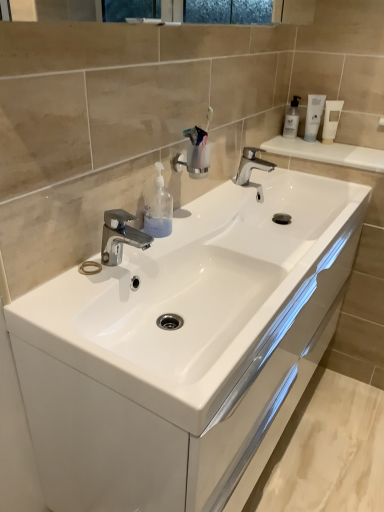
Where is `free space behind polished chrome faucet at center, which is counted as the 2th tap, starting from the right`? free space behind polished chrome faucet at center, which is counted as the 2th tap, starting from the right is located at coordinates (160, 245).